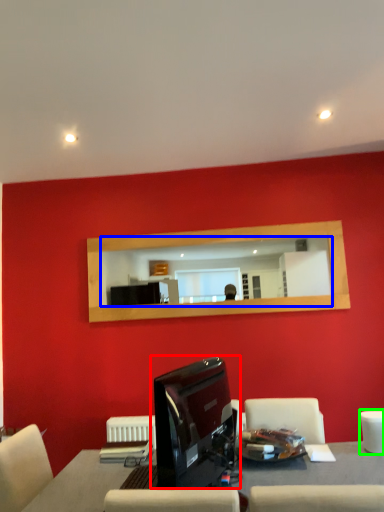
Question: Which object is the farthest from computer monitor (highlighted by a red box)? Choose among these: mirror (highlighted by a blue box) or armchair (highlighted by a green box).

Choices:
 (A) mirror
 (B) armchair

Answer: (A)